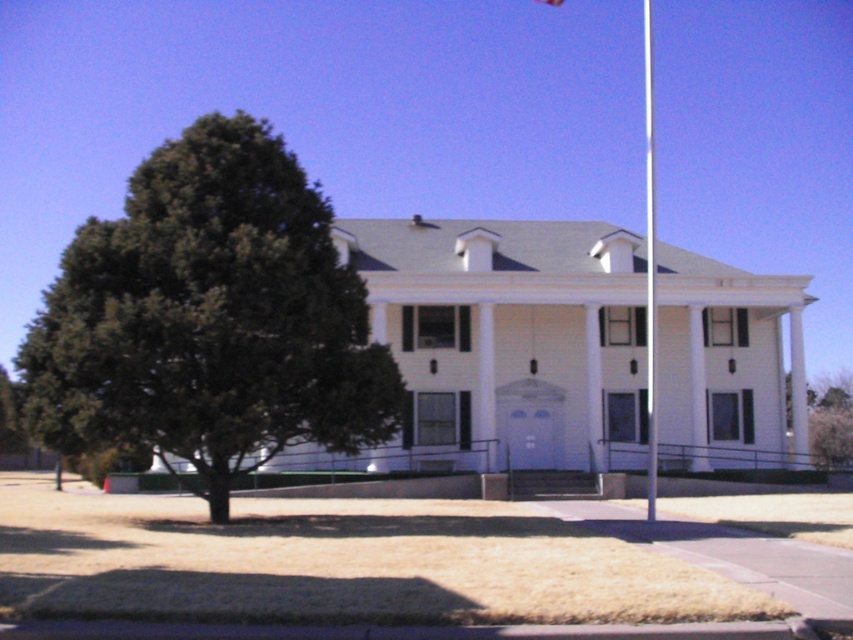
You are a maintenance worker who needs to replace the flag on the flag pole. The flag you have is 100 feet long. Considering the distance between the white glossy flag pole at center and the white fabric flag at upper center, will your new flag be long enough to reach from the pole to the flag?

The distance between the white glossy flag pole at center and the white fabric flag at upper center is 93.51 feet. Since your flag is 100 feet long, it will be long enough to reach from the pole to the flag.

You are standing in front of the two story white building with a symmetrical design. You notice a point marked at coordinates (209, 317). Based on the scene description, can you determine what object this point is located on?

The point at (209, 317) is located on the green leafy tree at left.

You are planning to install a new bench in the lawn between the green leafy tree at left and the white glossy flag pole at center. The bench will be 2 meters long. If you want to place it exactly halfway between them, will there be enough space for the bench to fit without overlapping either object?

The distance between the green leafy tree at left and the white glossy flag pole at center is 17.56 meters. Half of that distance is 8.78 meters. Since the bench is only 2 meters long, placing it halfway would leave ample space on both ends, so yes, it will fit without overlapping either object.